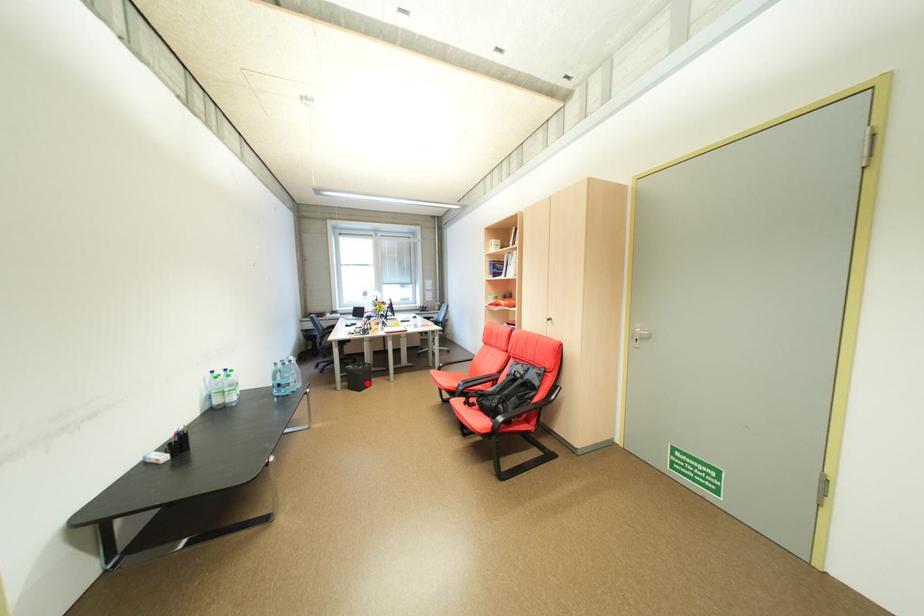
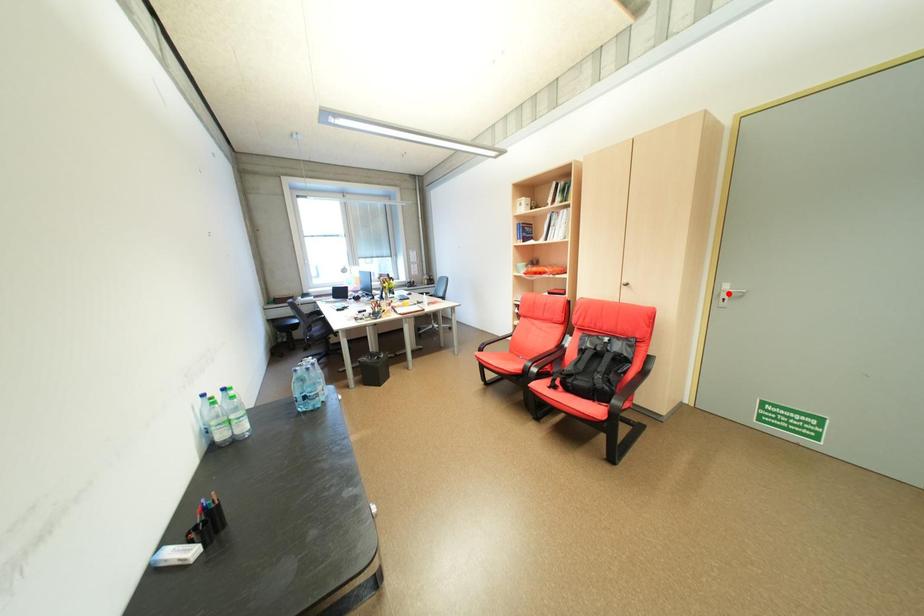
I am providing you with two images of the same scene from different viewpoints. A red point is marked on the first image and another point is marked on the second image. Does the point marked in image1 correspond to the same location as the one in image2?

No